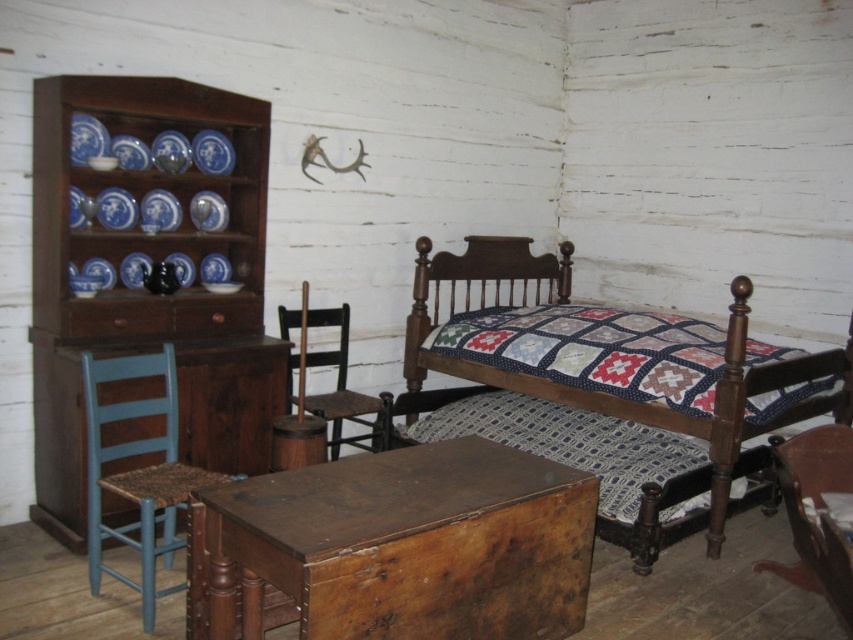
You are an interior designer planning to add a new rug to the room. The quilted fabric bed at center is currently placed over the quilted fabric at center. Where should the new rug be placed to ensure it is under both objects?

The new rug should be placed under both the quilted fabric bed at center and the quilted fabric at center, as the quilted fabric bed at center is above the quilted fabric at center, meaning the existing fabric is already under the bed. Placing the rug underneath would require it to be positioned below both items.

You are standing in the room and want to reach both points, point (90, 356) and point (844, 588). Which point is closer to you?

Point (90, 356) is closer to you than point (844, 588) because it is further to the viewer.

You are standing in the room and want to reach the point marked at coordinates (836,540). If you have a 2.5 meter long pole, can you just barely reach that point with the pole?

The point at coordinates (836,540) is 2.36 meters away from the viewer. Since the pole is 2.5 meters long, which is slightly longer than the distance, you can just barely reach the point with the pole.